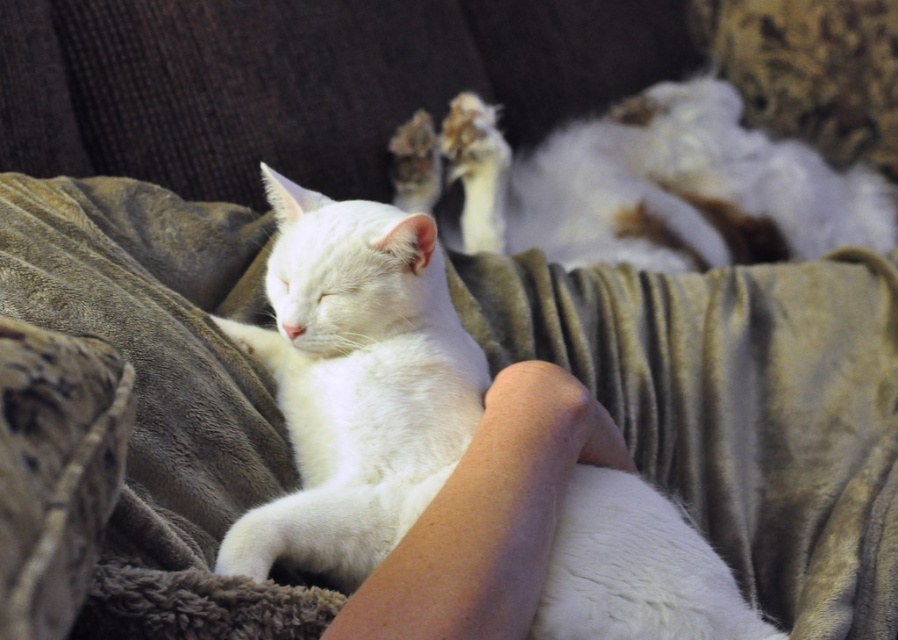
You are a photographer trying to capture the white fluffy cat at center and the white fluffy cat at upper center in a single frame. Which cat will appear smaller in the photo?

The white fluffy cat at center appears smaller because it has a lesser width compared to the white fluffy cat at upper center.

You are a photographer trying to capture the white fluffy cat at center and the white fluffy cat at upper center. Which cat should you focus on first if you want to take a clear photo of the one closer to you?

The white fluffy cat at center is closer to the viewer than the white fluffy cat at upper center, so you should focus on the white fluffy cat at center first to ensure a clear photo.

You are a cat owner who wants to place a small toy between the white fluffy cat at center and the white fluffy cat at upper center. Can you fit the toy if it requires 75 centimeters of space?

The distance between the white fluffy cat at center and the white fluffy cat at upper center is 76.13 centimeters, so yes, the toy can fit as there is enough space.